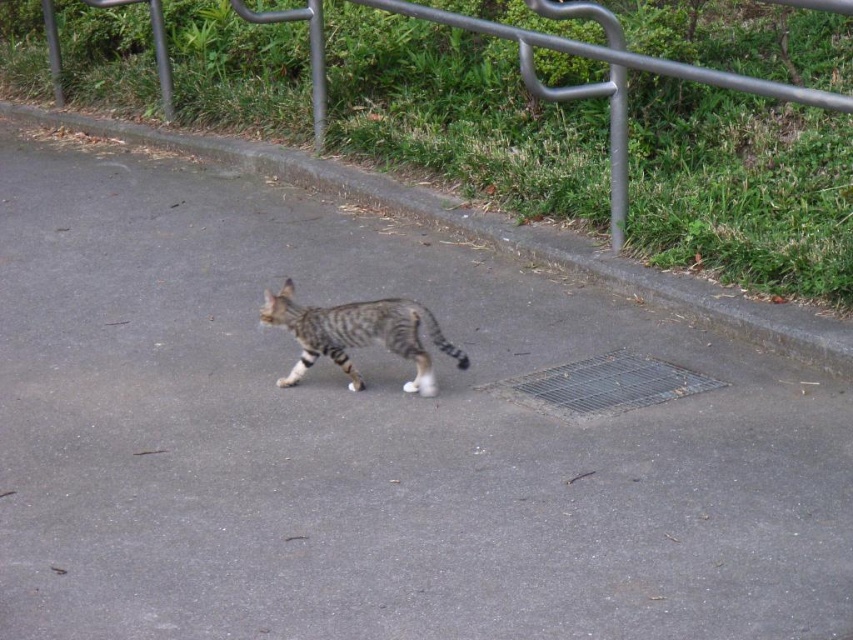
Question: Does brushed metal fence at upper center have a lesser width compared to striped fur cat at center?

Choices:
 (A) yes
 (B) no

Answer: (A)

Question: Does brushed metal fence at upper center have a smaller size compared to striped fur cat at center?

Choices:
 (A) no
 (B) yes

Answer: (B)

Question: Among these objects, which one is nearest to the camera?

Choices:
 (A) striped fur cat at center
 (B) brushed metal fence at upper center

Answer: (A)

Question: Can you confirm if brushed metal fence at upper center is positioned below striped fur cat at center?

Choices:
 (A) no
 (B) yes

Answer: (A)

Question: Which object appears farthest from the camera in this image?

Choices:
 (A) striped fur cat at center
 (B) brushed metal fence at upper center

Answer: (B)